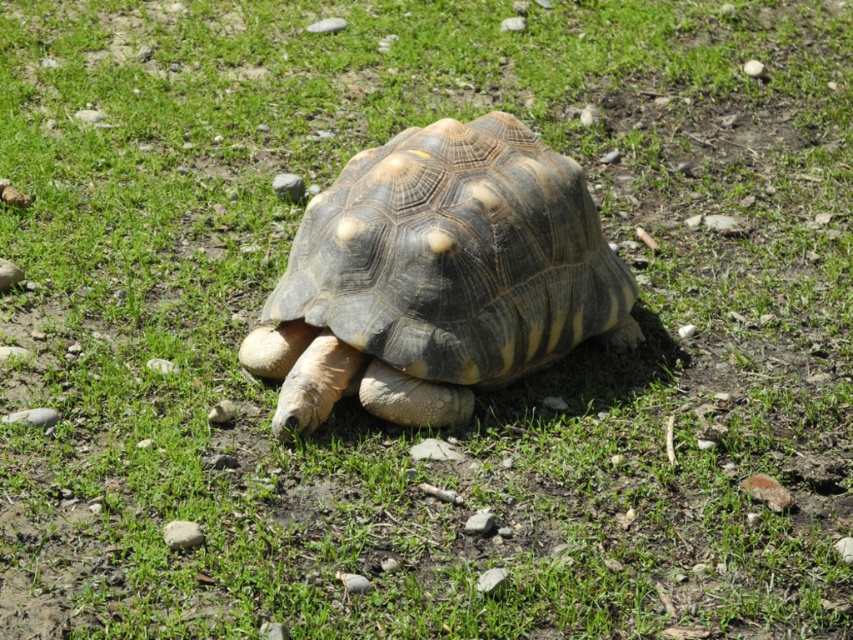
Question: Among these points, which one is farthest from the camera?

Choices:
 (A) (345, 182)
 (B) (173, 520)
 (C) (0, 276)
 (D) (289, 184)

Answer: (D)

Question: Can you confirm if leathery brown tortoise at center is positioned to the right of smooth gray rock at lower left?

Choices:
 (A) yes
 (B) no

Answer: (A)

Question: Can you confirm if leathery brown tortoise at center is thinner than smooth gray rock at lower left?

Choices:
 (A) yes
 (B) no

Answer: (B)

Question: Is gray gravel at lower left to the right of gray gravel stone at lower left from the viewer's perspective?

Choices:
 (A) yes
 (B) no

Answer: (A)

Question: Among these objects, which one is nearest to the camera?

Choices:
 (A) gray gravel at lower left
 (B) smooth gray rock at lower left
 (C) gray gravel stone at lower left
 (D) gray rock at center

Answer: (B)

Question: Which of the following is the farthest from the observer?

Choices:
 (A) (10, 417)
 (B) (196, 525)
 (C) (300, 188)
 (D) (10, 276)

Answer: (C)